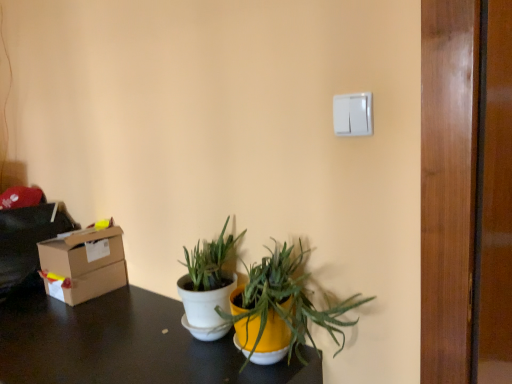
The height and width of the screenshot is (384, 512). What are the coordinates of `vacant space to the left of white matte pot at center, the second houseplant in the left-to-right sequence` in the screenshot? It's located at (179, 361).